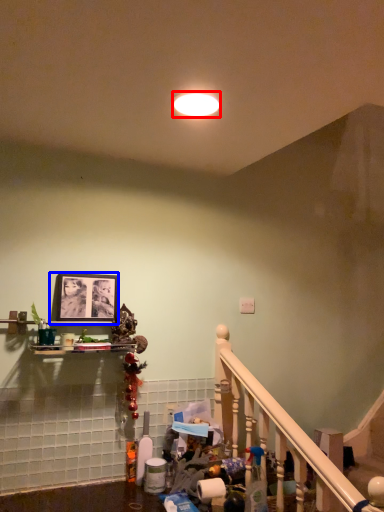
Question: Among these objects, which one is farthest to the camera, lighting (highlighted by a red box) or picture frame (highlighted by a blue box)?

Choices:
 (A) lighting
 (B) picture frame

Answer: (B)